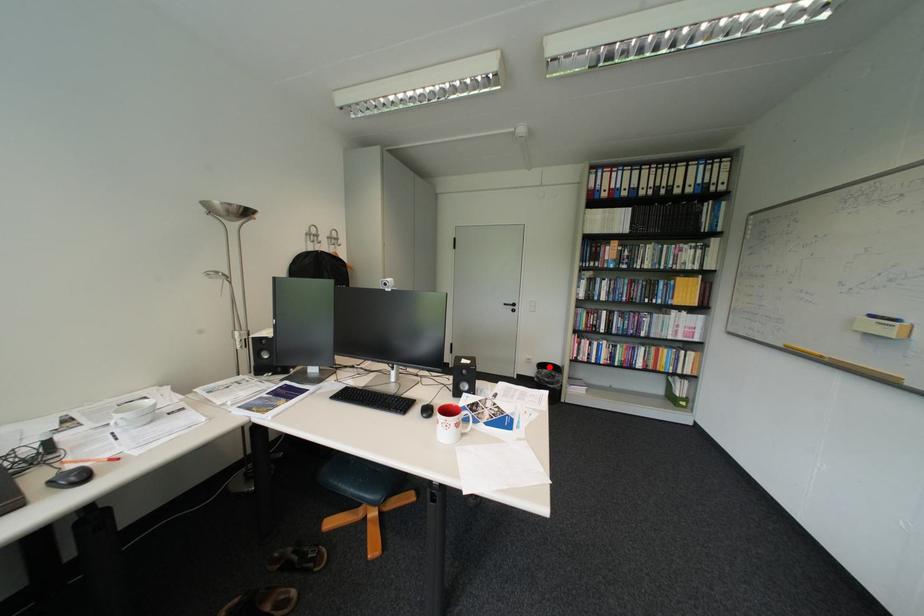
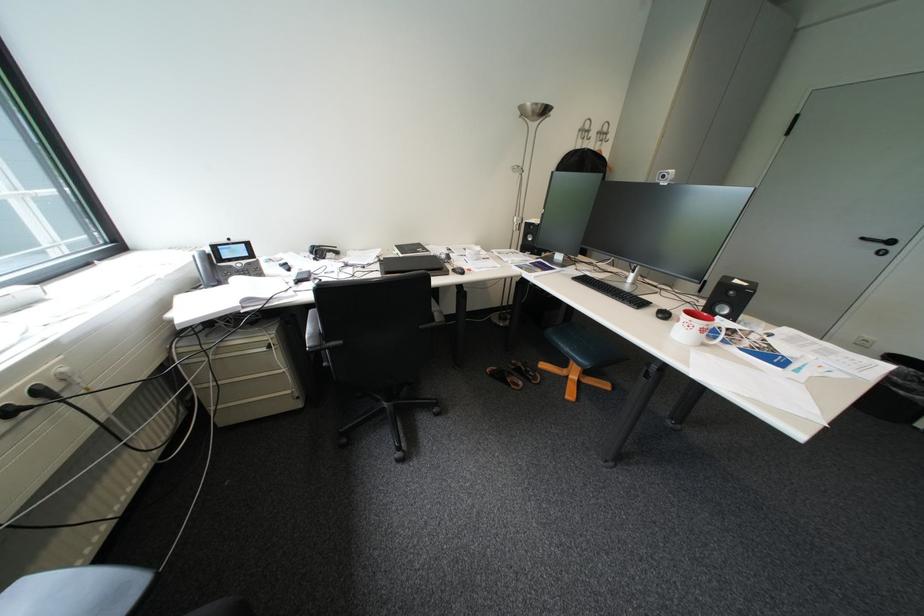
Where in the second image is the point corresponding to the highlighted location from the first image?

(895, 358)